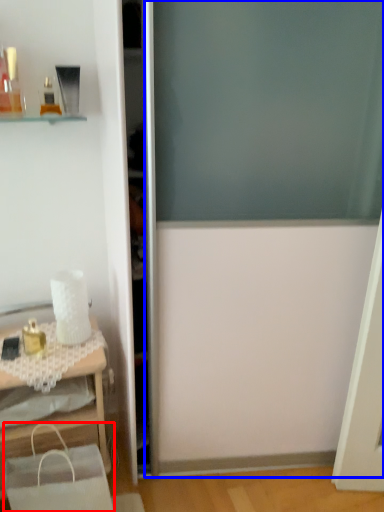
Question: Among these objects, which one is nearest to the camera, shopping bag (highlighted by a red box) or screen door (highlighted by a blue box)?

Choices:
 (A) shopping bag
 (B) screen door

Answer: (B)